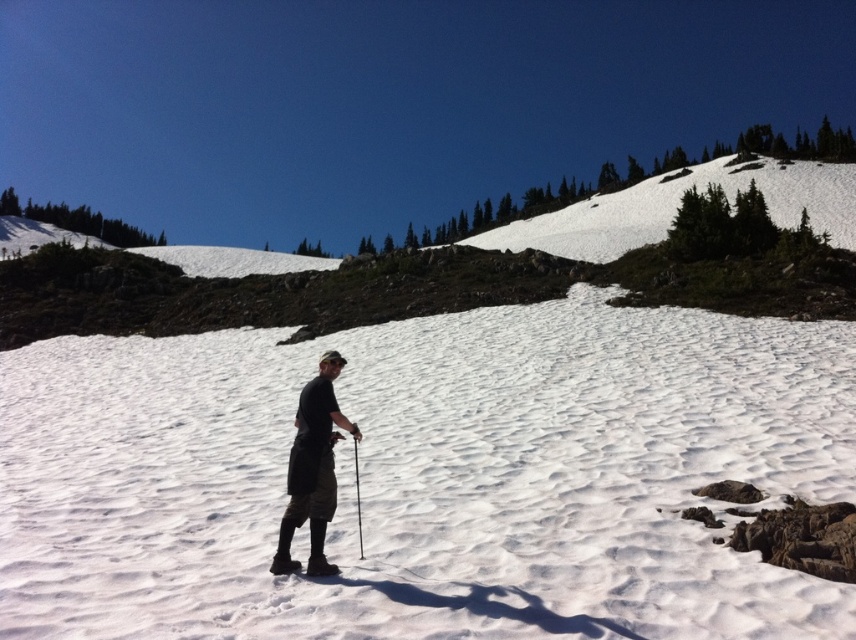
You are a hiker trying to place your metallic silver ski pole at center into the white fluffy snow at center. Based on their positions, can you determine if the pole will be placed on the snow?

The white fluffy snow at center is to the right of the metallic silver ski pole at center, so the pole is not placed on the snow. You should move the pole to the left to place it on the snow.

You are a hiker trying to determine which item is taller between the dark gray fabric shorts at center and the metallic silver ski pole at center. Based on the scene, which one is taller?

The dark gray fabric shorts at center is taller than the metallic silver ski pole at center according to the description.

You are planning to take a photo of the hiker. The camera is set to focus on the white fluffy snow at center. Since the dark gray fabric shorts at center is closer to the camera, will it be in focus?

The white fluffy snow at center is wider than the dark gray fabric shorts at center, but the question is about focus distance. The description only provides information about their widths, not their distances from the camera. Therefore, based on the given information, we cannot determine if the dark gray fabric shorts at center will be in focus.